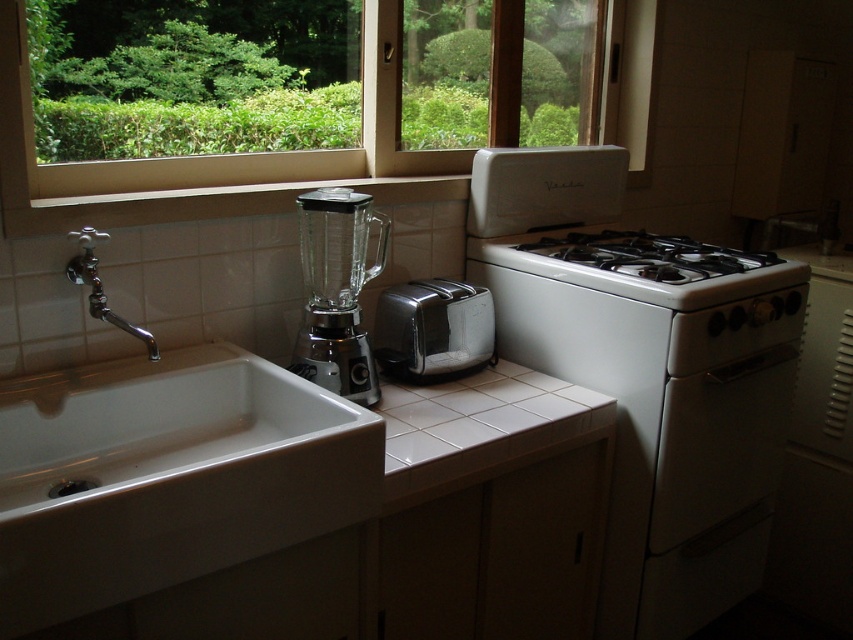
Question: Does transparent glass blender at center lie in front of white glossy gas stove at right?

Choices:
 (A) no
 (B) yes

Answer: (B)

Question: Which point appears closest to the camera in this image?

Choices:
 (A) (376, 355)
 (B) (74, 273)
 (C) (372, 460)

Answer: (C)

Question: From the image, what is the correct spatial relationship of satin chrome toaster at center in relation to white glossy gas stove at right?

Choices:
 (A) below
 (B) above

Answer: (A)

Question: Which point appears closest to the camera in this image?

Choices:
 (A) (490, 308)
 (B) (190, 348)
 (C) (485, 259)
 (D) (126, 323)

Answer: (D)

Question: In this image, where is transparent glass blender at center located relative to chrome/metallic faucet at left?

Choices:
 (A) left
 (B) right

Answer: (B)

Question: Estimate the real-world distances between objects in this image. Which object is farther from the white tile countertop at center?

Choices:
 (A) satin chrome toaster at center
 (B) transparent glass blender at center
 (C) white glossy oven at right

Answer: (C)